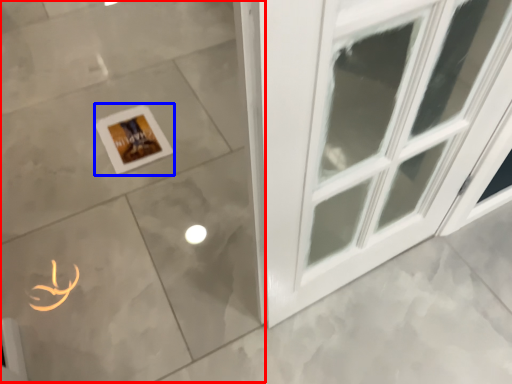
Question: Which object appears closest to the camera in this image, ceramic tile (highlighted by a red box) or picture frame (highlighted by a blue box)?

Choices:
 (A) ceramic tile
 (B) picture frame

Answer: (A)